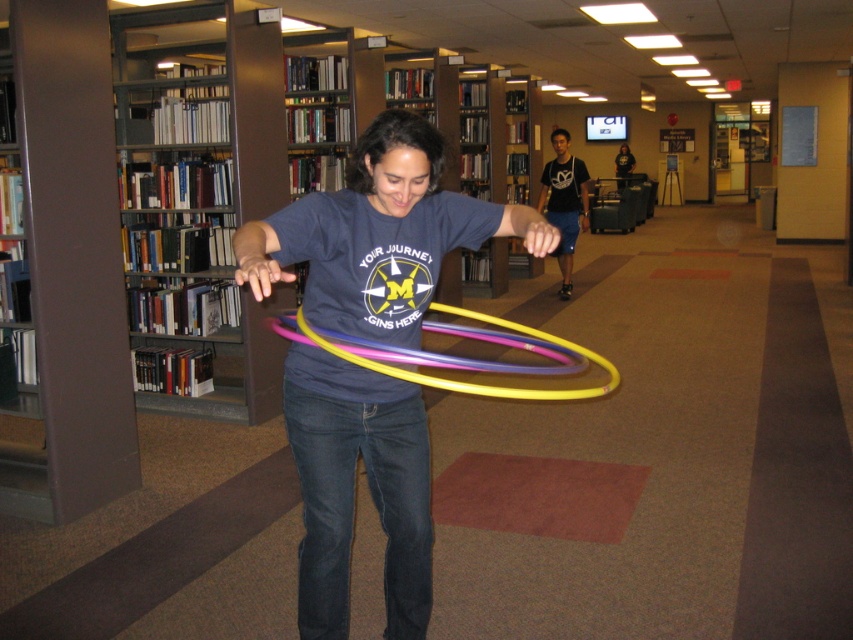
Question: Observing the image, what is the correct spatial positioning of wooden bookshelf at left in reference to multicolored plastic hula hoop at center?

Choices:
 (A) above
 (B) below

Answer: (A)

Question: Which of the following is the farthest from the observer?

Choices:
 (A) wooden bookshelf at left
 (B) matte blue t-shirt at center

Answer: (A)

Question: Can you confirm if wooden bookshelf at left is smaller than multicolored plastic hula hoop at center?

Choices:
 (A) no
 (B) yes

Answer: (A)

Question: Observing the image, what is the correct spatial positioning of wooden bookshelf at left in reference to matte blue t-shirt at center?

Choices:
 (A) above
 (B) below

Answer: (A)

Question: Which object is the closest to the wooden bookshelf at left?

Choices:
 (A) multicolored plastic hula hoop at center
 (B) matte blue t-shirt at center

Answer: (A)

Question: Which of the following is the closest to the observer?

Choices:
 (A) (434, 358)
 (B) (257, 353)
 (C) (345, 486)

Answer: (A)